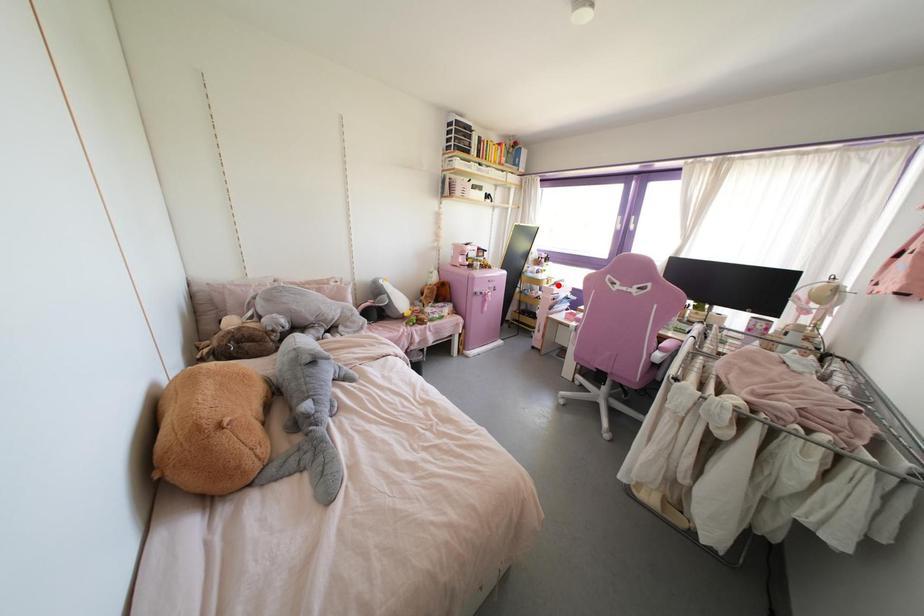
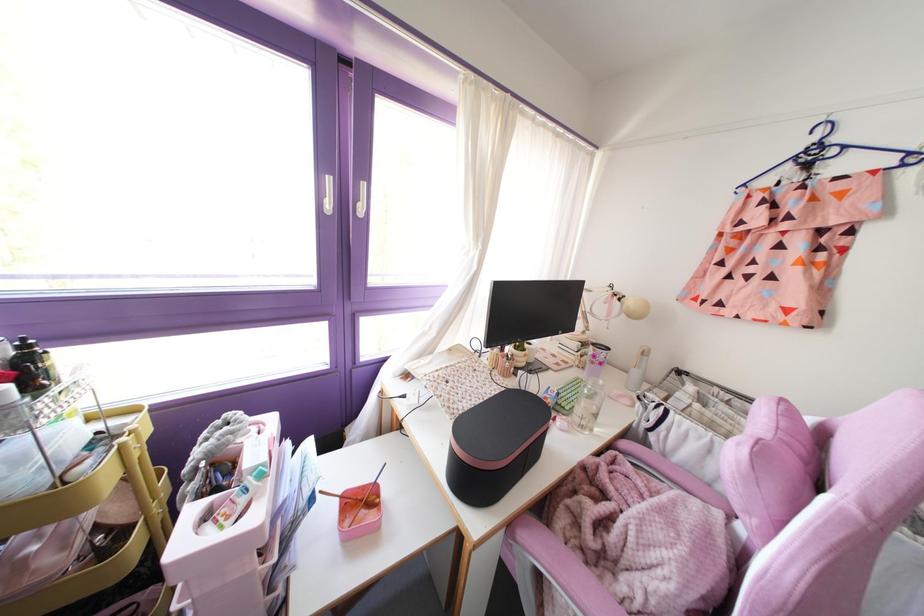
Where in the second image is the point corresponding to the highlighted location from the first image?

(261, 475)